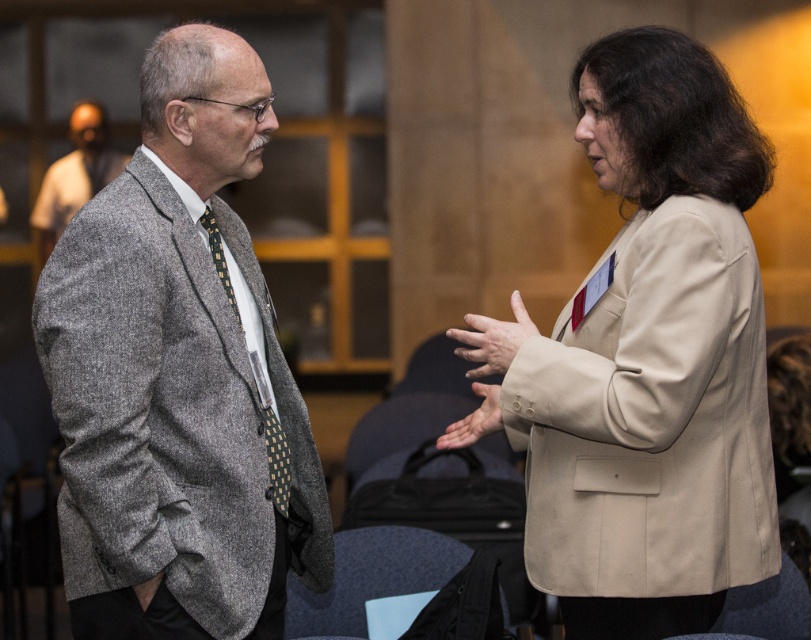
Is gray woolen suit at left wider than green dotted tie at center?

Correct, the width of gray woolen suit at left exceeds that of green dotted tie at center.

Can you confirm if gray woolen suit at left is positioned to the right of green dotted tie at center?

No, gray woolen suit at left is not to the right of green dotted tie at center.

Between point (200, 464) and point (208, 209), which one is positioned behind?

The point (208, 209) is more distant.

The image size is (811, 640). I want to click on gray woolen suit at left, so click(x=179, y=376).

Is gray wool suit at left smaller than beige fabric hand at center?

Actually, gray wool suit at left might be larger than beige fabric hand at center.

Is gray wool suit at left positioned in front of beige fabric hand at center?

No, it is not.

Image resolution: width=811 pixels, height=640 pixels. Find the location of `gray wool suit at left`. gray wool suit at left is located at coordinates (75, 173).

Locate an element on the screen. This screenshot has height=640, width=811. gray wool suit at left is located at coordinates (75, 173).

Does gray woolen suit at left have a larger size compared to smooth beige hand at center?

Indeed, gray woolen suit at left has a larger size compared to smooth beige hand at center.

The image size is (811, 640). What do you see at coordinates (179, 376) in the screenshot?
I see `gray woolen suit at left` at bounding box center [179, 376].

This screenshot has height=640, width=811. What do you see at coordinates (179, 376) in the screenshot?
I see `gray woolen suit at left` at bounding box center [179, 376].

Where is `gray woolen suit at left`? Image resolution: width=811 pixels, height=640 pixels. gray woolen suit at left is located at coordinates (179, 376).